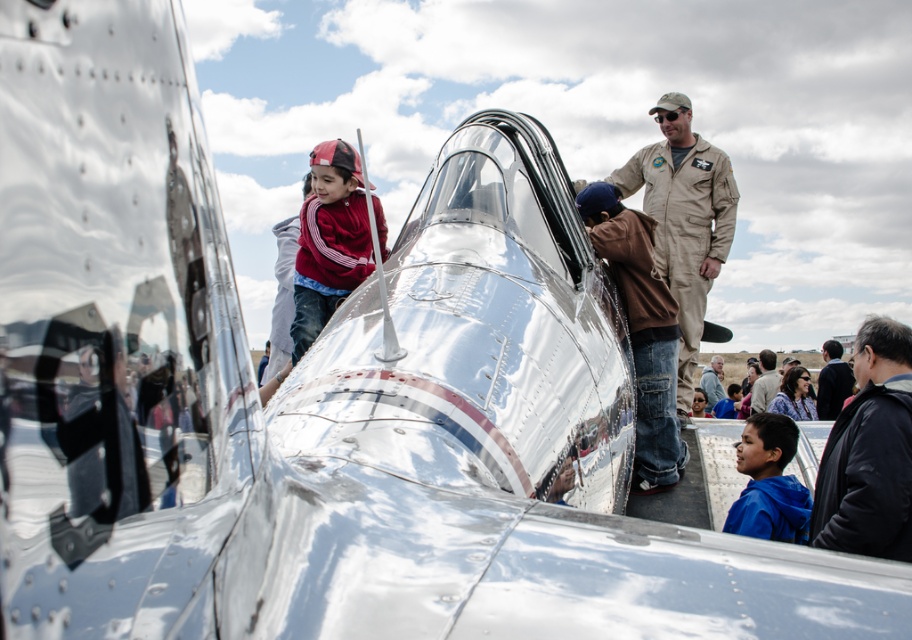
Question: Considering the real-world distances, which object is closest to the gray fabric jacket at lower right?

Choices:
 (A) dark gray jacket at lower right
 (B) blue fleece jacket at lower right
 (C) black leather jacket at lower right
 (D) khaki uniform at center

Answer: (A)

Question: Which of these objects is positioned farthest from the dark brown leather jacket at lower right?

Choices:
 (A) gray fabric jacket at lower right
 (B) dark gray jacket at lower right
 (C) khaki uniform at center

Answer: (C)

Question: In this image, where is black leather jacket at lower right located relative to dark brown leather jacket at lower right?

Choices:
 (A) left
 (B) right

Answer: (A)

Question: Is khaki uniform at center to the left of gray fabric jacket at lower right from the viewer's perspective?

Choices:
 (A) yes
 (B) no

Answer: (A)

Question: Among these points, which one is nearest to the camera?

Choices:
 (A) (672, 156)
 (B) (759, 440)
 (C) (771, 371)
 (D) (846, 372)

Answer: (B)

Question: Is black leather jacket at lower right positioned behind dark brown leather jacket at lower right?

Choices:
 (A) yes
 (B) no

Answer: (B)